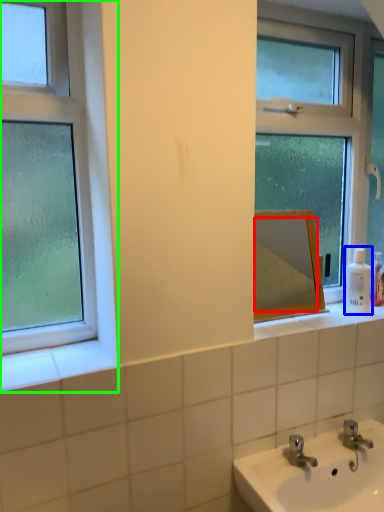
Question: Which is nearer to the mirror (highlighted by a red box)? toiletry (highlighted by a blue box) or window (highlighted by a green box).

Choices:
 (A) toiletry
 (B) window

Answer: (A)